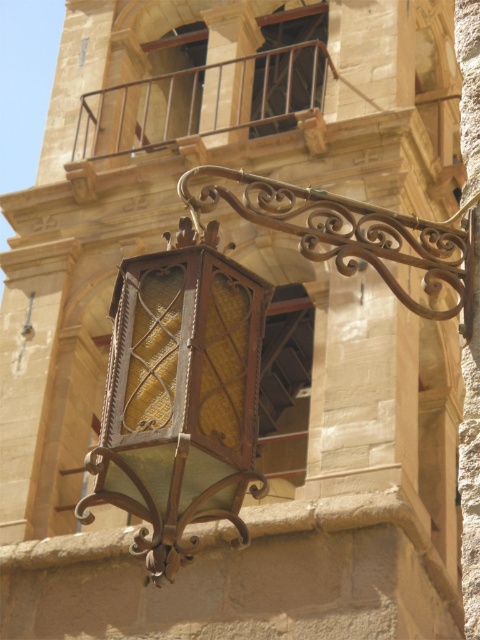
Question: Which object is farther from the camera taking this photo?

Choices:
 (A) matte glass lantern at center
 (B) rustic metal balcony at upper center

Answer: (B)

Question: Which point is farther from the camera taking this photo?

Choices:
 (A) (144, 474)
 (B) (91, 145)

Answer: (B)

Question: Which of the following is the farthest from the observer?

Choices:
 (A) (256, 378)
 (B) (168, 99)

Answer: (B)

Question: Can you confirm if matte glass lantern at center is bigger than rustic metal balcony at upper center?

Choices:
 (A) yes
 (B) no

Answer: (B)

Question: Is the position of matte glass lantern at center more distant than that of rustic metal balcony at upper center?

Choices:
 (A) no
 (B) yes

Answer: (A)

Question: Is the position of matte glass lantern at center less distant than that of rustic metal balcony at upper center?

Choices:
 (A) yes
 (B) no

Answer: (A)